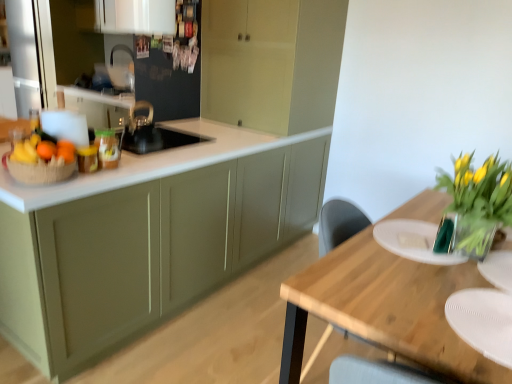
Question: Is matte green cabinets at center, which is the second cabinetry in back-to-front order, not near translucent glass vase at right?

Choices:
 (A) yes
 (B) no

Answer: (A)

Question: Is matte green cabinets at center, the third cabinetry in the front-to-back sequence, aimed at translucent glass vase at right?

Choices:
 (A) no
 (B) yes

Answer: (A)

Question: Can we say matte green cabinets at center, which is the second cabinetry in back-to-front order, lies outside translucent glass vase at right?

Choices:
 (A) yes
 (B) no

Answer: (A)

Question: Is matte green cabinets at center, which is the second cabinetry in back-to-front order, with translucent glass vase at right?

Choices:
 (A) yes
 (B) no

Answer: (B)

Question: Does matte green cabinets at center, which is the second cabinetry in back-to-front order, have a larger size compared to translucent glass vase at right?

Choices:
 (A) yes
 (B) no

Answer: (A)

Question: Is matte green cabinets at center, which is the second cabinetry in back-to-front order, positioned behind translucent glass vase at right?

Choices:
 (A) yes
 (B) no

Answer: (A)

Question: From a real-world perspective, is matte green cabinets at center, placed as the 3th cabinetry when sorted from back to front, physically above orange matte at left?

Choices:
 (A) yes
 (B) no

Answer: (B)

Question: Is matte green cabinets at center, the 2th cabinetry viewed from the front, positioned with its back to orange matte at left?

Choices:
 (A) yes
 (B) no

Answer: (B)

Question: Does matte green cabinets at center, placed as the 3th cabinetry when sorted from back to front, have a larger size compared to orange matte at left?

Choices:
 (A) yes
 (B) no

Answer: (A)

Question: Is matte green cabinets at center, the 2th cabinetry viewed from the front, not inside orange matte at left?

Choices:
 (A) no
 (B) yes

Answer: (B)

Question: Is matte green cabinets at center, placed as the 3th cabinetry when sorted from back to front, next to orange matte at left?

Choices:
 (A) no
 (B) yes

Answer: (A)

Question: From the image's perspective, is matte green cabinets at center, the 2th cabinetry viewed from the front, located beneath orange matte at left?

Choices:
 (A) yes
 (B) no

Answer: (A)

Question: Would you consider translucent glass vase at right to be distant from white glossy cabinet at upper center, placed as the fourth cabinetry when sorted from front to back?

Choices:
 (A) yes
 (B) no

Answer: (A)